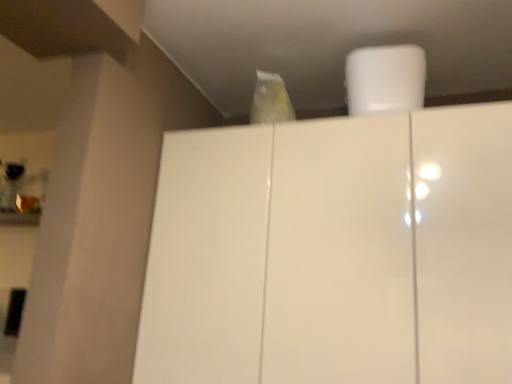
Question: Is white matte paper towel at upper center smaller than glossy white cupboard at center?

Choices:
 (A) yes
 (B) no

Answer: (A)

Question: Does white matte paper towel at upper center have a greater height compared to glossy white cupboard at center?

Choices:
 (A) yes
 (B) no

Answer: (B)

Question: Considering the relative positions of white matte paper towel at upper center and glossy white cupboard at center in the image provided, is white matte paper towel at upper center to the left of glossy white cupboard at center from the viewer's perspective?

Choices:
 (A) no
 (B) yes

Answer: (A)

Question: Is white matte paper towel at upper center bigger than glossy white cupboard at center?

Choices:
 (A) no
 (B) yes

Answer: (A)

Question: From the image's perspective, does white matte paper towel at upper center appear higher than glossy white cupboard at center?

Choices:
 (A) yes
 (B) no

Answer: (A)

Question: Is white matte paper towel at upper center looking in the opposite direction of glossy white cupboard at center?

Choices:
 (A) no
 (B) yes

Answer: (A)

Question: Is glossy white cupboard at center closer to the viewer compared to white matte paper towel at upper center?

Choices:
 (A) no
 (B) yes

Answer: (B)

Question: Is glossy white cupboard at center wider than white matte paper towel at upper center?

Choices:
 (A) no
 (B) yes

Answer: (B)

Question: From the image's perspective, is glossy white cupboard at center above white matte paper towel at upper center?

Choices:
 (A) yes
 (B) no

Answer: (B)

Question: Is glossy white cupboard at center further to camera compared to white matte paper towel at upper center?

Choices:
 (A) no
 (B) yes

Answer: (A)

Question: Would you say glossy white cupboard at center is outside white matte paper towel at upper center?

Choices:
 (A) no
 (B) yes

Answer: (B)

Question: Does glossy white cupboard at center appear on the right side of white matte paper towel at upper center?

Choices:
 (A) no
 (B) yes

Answer: (A)

Question: From a real-world perspective, is glossy white cupboard at center above or below white matte paper towel at upper center?

Choices:
 (A) below
 (B) above

Answer: (A)